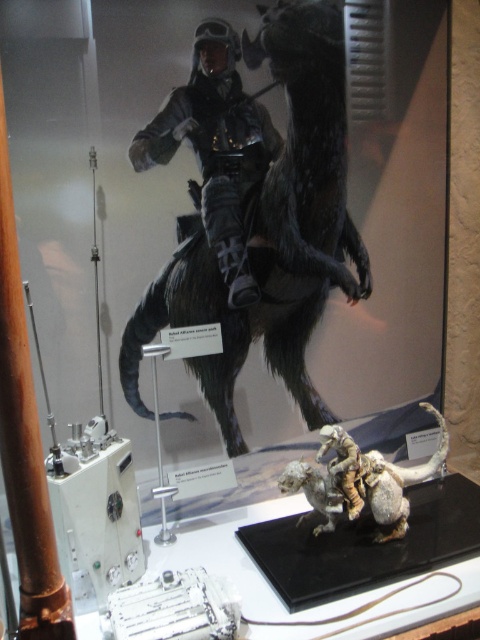
Based on the photo, you are standing at the point marked as point (322, 403) in the display case. You want to reach the exit located at the other end of the display case. There is a glass barrier between you and the exit. The barrier is 6.36 feet away from your current position. Can you safely walk around the glass barrier to reach the exit without touching it?

The distance between you and the glass barrier is 6.36 feet, so yes, you can safely walk around it to reach the exit without touching the barrier.

You are a film prop designer analyzing the display case. You need to determine if the shiny silver spacesuit at upper center can be safely placed on top of the furry black horse at center without damaging either item. Based on their sizes, is this feasible?

The furry black horse at center is larger in size compared to the shiny silver spacesuit at upper center, so placing the spacesuit on top should be feasible as the horse can support its weight and size without causing damage.